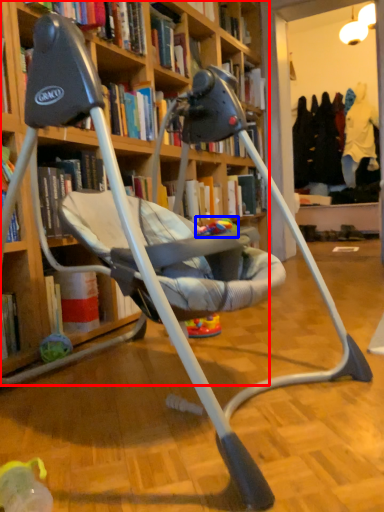
Question: Which point is closer to the camera, bookcase (highlighted by a red box) or toy (highlighted by a blue box)?

Choices:
 (A) bookcase
 (B) toy

Answer: (A)